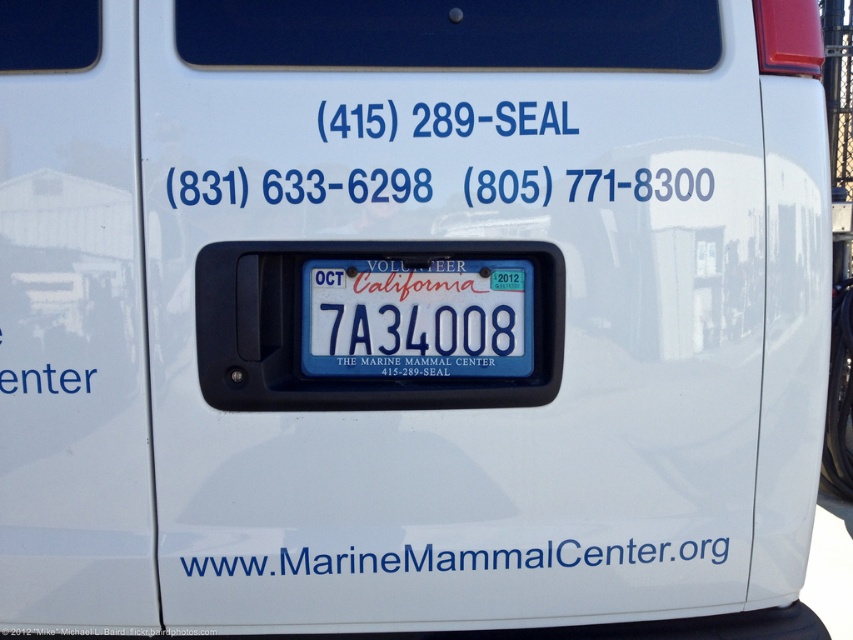
Question: Can you confirm if blue plastic license plate at center is bigger than white plastic text at lower center?

Choices:
 (A) no
 (B) yes

Answer: (A)

Question: Can you confirm if blue plastic license plate at center is thinner than white plastic text at lower center?

Choices:
 (A) no
 (B) yes

Answer: (B)

Question: Which point is closer to the camera?

Choices:
 (A) (425, 564)
 (B) (314, 353)

Answer: (B)

Question: Where is blue plastic license plate at center located in relation to white plastic text at lower center in the image?

Choices:
 (A) right
 (B) left

Answer: (B)

Question: Which of the following is the farthest from the observer?

Choices:
 (A) (445, 566)
 (B) (395, 353)

Answer: (A)

Question: Which point appears closest to the camera in this image?

Choices:
 (A) (538, 561)
 (B) (368, 307)

Answer: (B)